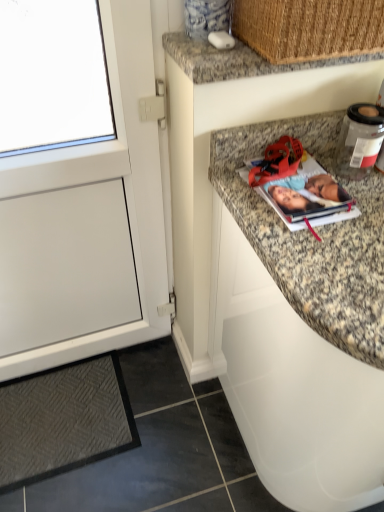
Locate an element on the screen. Image resolution: width=384 pixels, height=512 pixels. free location above dark gray textured mat at lower left (from a real-world perspective) is located at coordinates (73, 412).